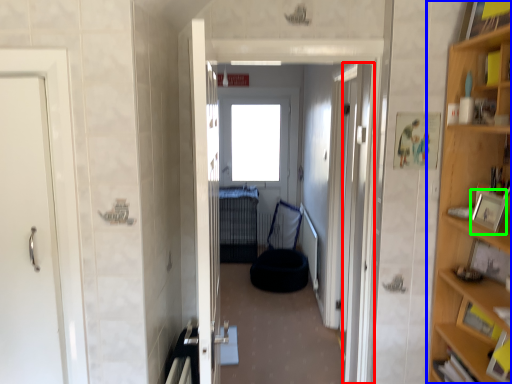
Question: Considering the real-world distances, which object is closest to door (highlighted by a red box)? cabinetry (highlighted by a blue box) or picture frame (highlighted by a green box).

Choices:
 (A) cabinetry
 (B) picture frame

Answer: (A)